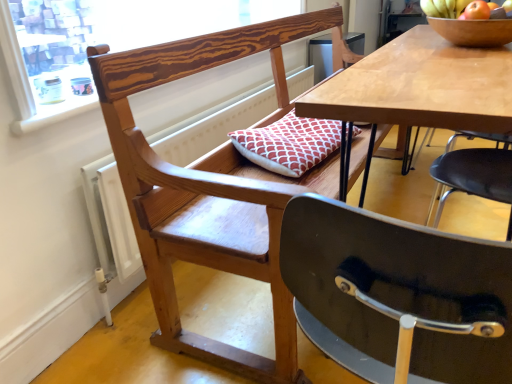
Question: From the image's perspective, is wooden bowl at upper right located above wooden frame at upper left?

Choices:
 (A) yes
 (B) no

Answer: (B)

Question: Could wooden frame at upper left be considered to be inside wooden bowl at upper right?

Choices:
 (A) yes
 (B) no

Answer: (B)

Question: From the image's perspective, is wooden bowl at upper right located beneath wooden frame at upper left?

Choices:
 (A) no
 (B) yes

Answer: (B)

Question: Is wooden bowl at upper right thinner than wooden frame at upper left?

Choices:
 (A) no
 (B) yes

Answer: (A)

Question: Can you confirm if wooden bowl at upper right is wider than wooden frame at upper left?

Choices:
 (A) no
 (B) yes

Answer: (B)

Question: Is wooden bowl at upper right far from wooden frame at upper left?

Choices:
 (A) yes
 (B) no

Answer: (A)

Question: Does wooden chair with cushion at center have a lesser height compared to wooden frame at upper left?

Choices:
 (A) yes
 (B) no

Answer: (B)

Question: Considering the relative sizes of wooden chair with cushion at center and wooden frame at upper left in the image provided, is wooden chair with cushion at center taller than wooden frame at upper left?

Choices:
 (A) no
 (B) yes

Answer: (B)

Question: Is wooden frame at upper left located within wooden chair with cushion at center?

Choices:
 (A) no
 (B) yes

Answer: (A)

Question: Is wooden chair with cushion at center turned away from wooden frame at upper left?

Choices:
 (A) yes
 (B) no

Answer: (A)

Question: From the image's perspective, would you say wooden chair with cushion at center is positioned over wooden frame at upper left?

Choices:
 (A) no
 (B) yes

Answer: (A)

Question: Is wooden chair with cushion at center wider than wooden frame at upper left?

Choices:
 (A) yes
 (B) no

Answer: (A)

Question: Could you tell me if wooden frame at upper left is facing wooden bowl at upper right?

Choices:
 (A) no
 (B) yes

Answer: (A)